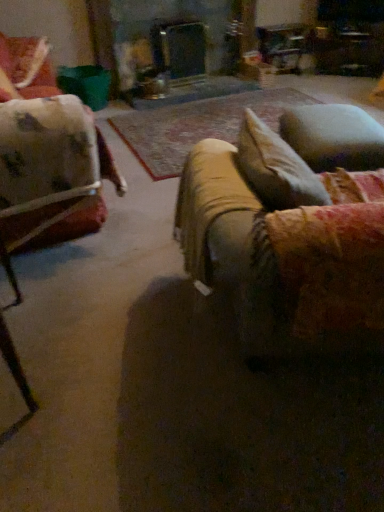
Where is `velvet beige couch at center`? velvet beige couch at center is located at coordinates (287, 256).

The image size is (384, 512). Describe the element at coordinates (28, 66) in the screenshot. I see `velvet floral chair at upper left` at that location.

Locate an element on the screen. velvet beige couch at center is located at coordinates (287, 256).

Based on the photo, considering the relative sizes of velvet floral chair at upper left and velvet beige couch at center in the image provided, is velvet floral chair at upper left taller than velvet beige couch at center?

Incorrect, the height of velvet floral chair at upper left is not larger of that of velvet beige couch at center.

Is velvet floral chair at upper left wider or thinner than velvet beige couch at center?

Considering their sizes, velvet floral chair at upper left looks slimmer than velvet beige couch at center.

Based on the photo, does velvet floral chair at upper left turn towards velvet beige couch at center?

Yes, velvet floral chair at upper left is turned towards velvet beige couch at center.

Considering the positions of points (23, 42) and (259, 278), is point (23, 42) farther from camera compared to point (259, 278)?

Yes.

What are the coordinates of `studio couch lying below the velvet floral chair at upper left (from the image's perspective)` in the screenshot? It's located at (287, 256).

Is velvet beige couch at center positioned with its back to velvet floral chair at upper left?

No.

From a real-world perspective, relative to velvet floral chair at upper left, is velvet beige couch at center vertically above or below?

In terms of real-world spatial position, velvet beige couch at center is below velvet floral chair at upper left.

From their relative heights in the image, would you say velvet floral chair at upper left is taller or shorter than velvety blue pillow at right?

velvet floral chair at upper left is taller than velvety blue pillow at right.

Is velvet floral chair at upper left in front of or behind velvety blue pillow at right in the image?

velvet floral chair at upper left is positioned farther from the viewer than velvety blue pillow at right.

From the image's perspective, which one is positioned higher, velvet floral chair at upper left or velvety blue pillow at right?

From the image's view, velvet floral chair at upper left is above.

Image resolution: width=384 pixels, height=512 pixels. I want to click on pillow in front of the velvet floral chair at upper left, so click(x=333, y=136).

Where is `pillow on the right of velvet beige couch at center`? pillow on the right of velvet beige couch at center is located at coordinates (333, 136).

Considering the sizes of objects velvety blue pillow at right and velvet beige couch at center in the image provided, who is bigger, velvety blue pillow at right or velvet beige couch at center?

velvet beige couch at center is bigger.

Is velvety blue pillow at right wider or thinner than velvet beige couch at center?

Considering their sizes, velvety blue pillow at right looks slimmer than velvet beige couch at center.

How far apart are velvety blue pillow at right and velvet beige couch at center?

velvety blue pillow at right and velvet beige couch at center are 37.85 inches apart.

Considering the sizes of objects velvet beige couch at center and velvety blue pillow at right in the image provided, who is taller, velvet beige couch at center or velvety blue pillow at right?

With more height is velvet beige couch at center.

Is velvety blue pillow at right located within velvet beige couch at center?

No, velvety blue pillow at right is not surrounded by velvet beige couch at center.

Considering the relative sizes of velvet beige couch at center and velvety blue pillow at right in the image provided, is velvet beige couch at center wider than velvety blue pillow at right?

Correct, the width of velvet beige couch at center exceeds that of velvety blue pillow at right.

Based on the photo, is velvety blue pillow at right turned away from velvet floral chair at upper left?

velvety blue pillow at right does not have its back to velvet floral chair at upper left.

Which is more to the right, velvety blue pillow at right or velvet floral chair at upper left?

Positioned to the right is velvety blue pillow at right.

Based on the photo, is velvety blue pillow at right in front of velvet floral chair at upper left?

Yes, velvety blue pillow at right is in front of velvet floral chair at upper left.

Locate an element on the screen. The height and width of the screenshot is (512, 384). studio couch below the velvet floral chair at upper left (from the image's perspective) is located at coordinates (287, 256).

Locate an element on the screen. studio couch in front of the velvet floral chair at upper left is located at coordinates (287, 256).

Which object lies further to the anchor point velvety blue pillow at right, velvet beige couch at center or velvet floral chair at upper left?

Based on the image, velvet floral chair at upper left appears to be further to velvety blue pillow at right.

Looking at the image, which one is located closer to velvet beige couch at center, velvety blue pillow at right or velvet floral chair at upper left?

Based on the image, velvety blue pillow at right appears to be nearer to velvet beige couch at center.

Based on their spatial positions, is velvet beige couch at center or velvety blue pillow at right closer to velvet floral chair at upper left?

The object closer to velvet floral chair at upper left is velvety blue pillow at right.

Based on their spatial positions, is velvet floral chair at upper left or velvet beige couch at center further from velvety blue pillow at right?

Among the two, velvet floral chair at upper left is located further to velvety blue pillow at right.

Considering their positions, is velvety blue pillow at right positioned closer to velvet floral chair at upper left than velvet beige couch at center?

Based on the image, velvety blue pillow at right appears to be nearer to velvet floral chair at upper left.

From the image, which object appears to be farther from velvet beige couch at center, velvet floral chair at upper left or velvety blue pillow at right?

velvet floral chair at upper left.

This screenshot has width=384, height=512. I want to click on studio couch situated between velvet floral chair at upper left and velvety blue pillow at right from left to right, so click(287, 256).